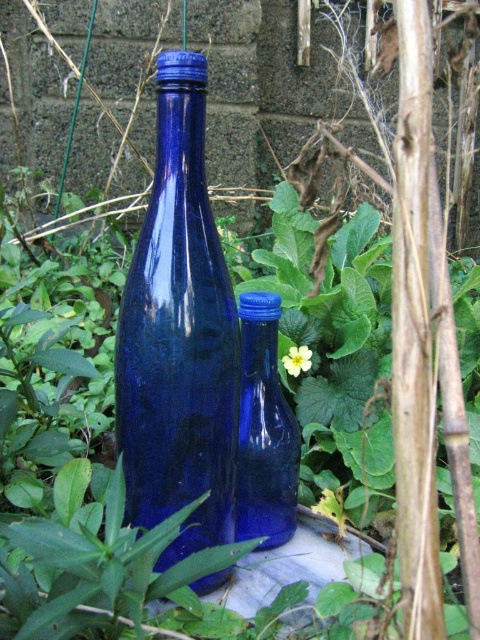
Who is positioned more to the right, blue glass bottle at center or yellow matte flower at center?

From the viewer's perspective, yellow matte flower at center appears more on the right side.

Between blue glass bottle at center and yellow matte flower at center, which one is positioned lower?

blue glass bottle at center is below.

Describe the element at coordinates (264, 429) in the screenshot. I see `blue glass bottle at center` at that location.

Where is `blue glass bottle at center`? The width and height of the screenshot is (480, 640). blue glass bottle at center is located at coordinates (264, 429).

In the scene shown: Does cobalt blue glass bottle at center appear over yellow matte flower at center?

Correct, cobalt blue glass bottle at center is located above yellow matte flower at center.

Is cobalt blue glass bottle at center to the right of yellow matte flower at center from the viewer's perspective?

Incorrect, cobalt blue glass bottle at center is not on the right side of yellow matte flower at center.

Which is behind, point (165, 168) or point (302, 349)?

The point (302, 349) is behind.

The width and height of the screenshot is (480, 640). What are the coordinates of `cobalt blue glass bottle at center` in the screenshot? It's located at (178, 336).

Does cobalt blue glass bottle at center have a larger size compared to blue glass bottle at center?

Yes.

Between point (191, 227) and point (264, 524), which one is positioned behind?

The point (264, 524) is behind.

Locate an element on the screen. cobalt blue glass bottle at center is located at coordinates (178, 336).